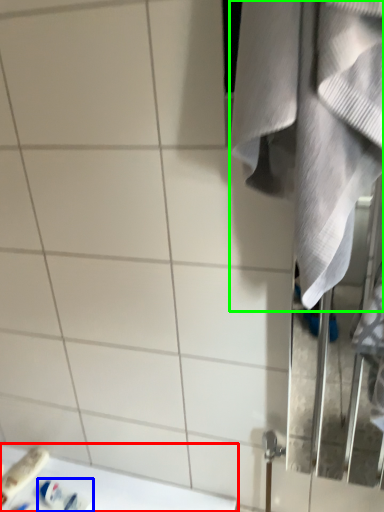
Question: Based on their relative distances, which object is nearer to counter top (highlighted by a red box)? Choose from toiletry (highlighted by a blue box) and towel (highlighted by a green box).

Choices:
 (A) toiletry
 (B) towel

Answer: (A)